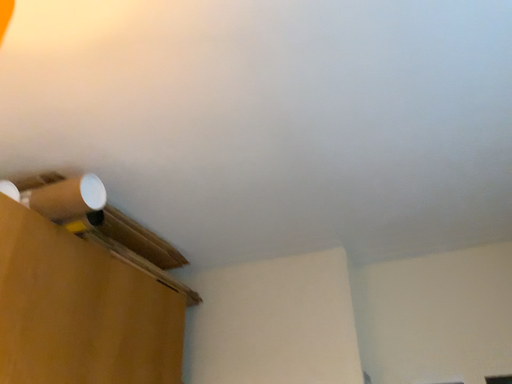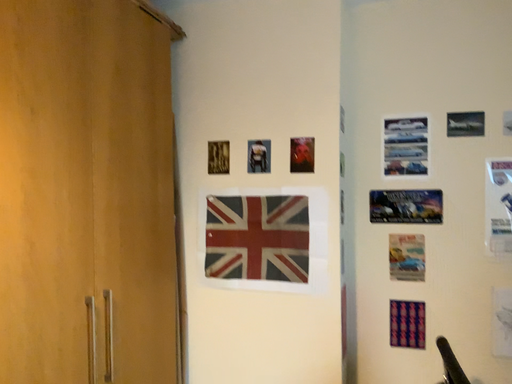
Question: How did the camera likely rotate when shooting the video?

Choices:
 (A) rotated downward
 (B) rotated upward

Answer: (A)